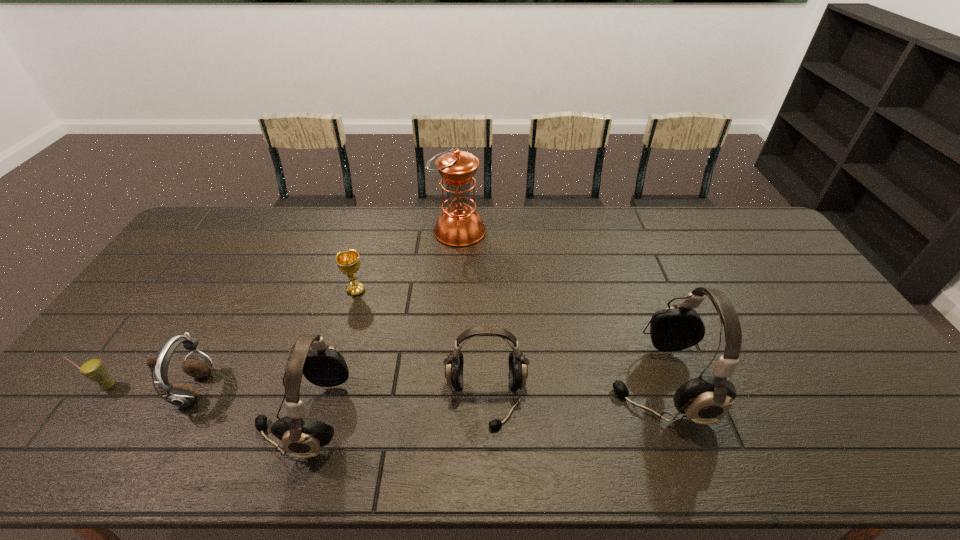
Please point a spot to add another headset on the right. Please provide its 2D coordinates. Your answer should be formatted as a tuple, i.e. [(x, y)], where the tuple contains the x and y coordinates of a point satisfying the conditions above.

[(818, 368)]